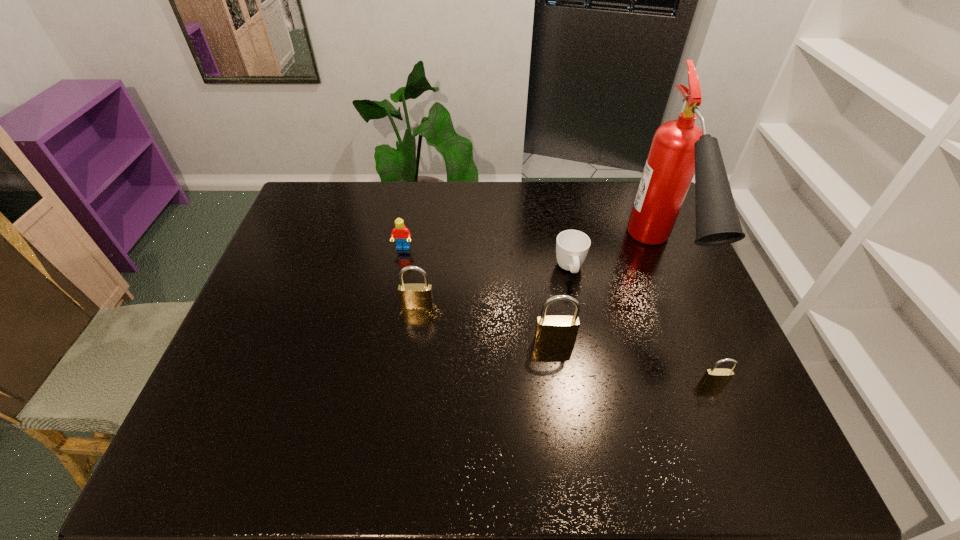
The image size is (960, 540). In order to click on the fourth shortest object in this screenshot , I will do `click(412, 296)`.

Where is `the second tallest padlock`? the second tallest padlock is located at coordinates (412, 296).

This screenshot has height=540, width=960. Identify the location of the second farthest padlock. [553, 330].

Locate an element on the screen. the second padlock from left to right is located at coordinates (553, 330).

This screenshot has width=960, height=540. I want to click on the shortest padlock, so click(x=713, y=377).

Where is `the rightmost padlock`? The image size is (960, 540). the rightmost padlock is located at coordinates (713, 377).

Locate an element on the screen. This screenshot has height=540, width=960. fire extinguisher is located at coordinates (680, 148).

Image resolution: width=960 pixels, height=540 pixels. I want to click on Lego, so click(401, 234).

In order to click on cup in this screenshot , I will do `click(572, 246)`.

Locate an element on the screen. This screenshot has height=540, width=960. free point located on the front-facing side of the third tallest object is located at coordinates (413, 342).